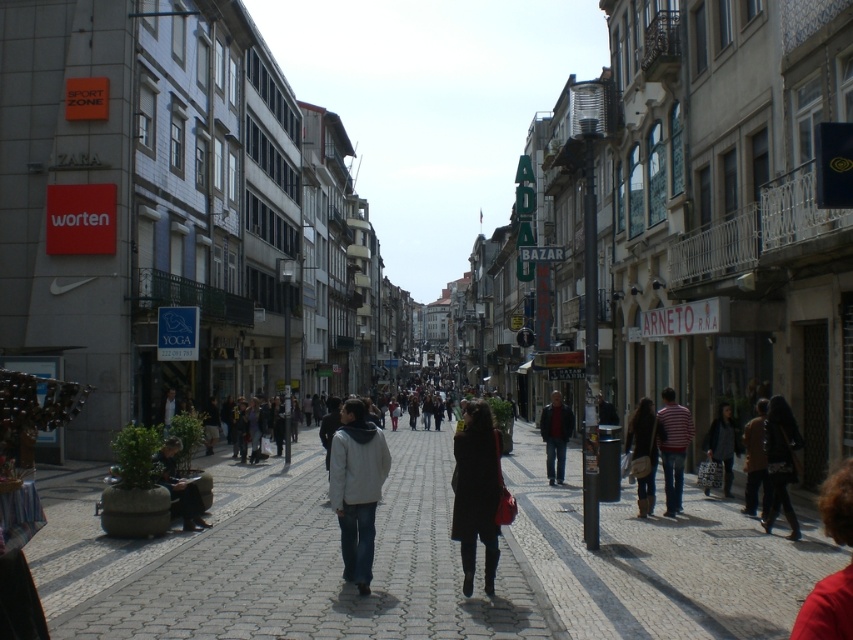
Based on the photo, you are a fashion designer observing the street scene and notice two items of clothing. The brown leather boots at lower right and the dark brown leather jacket at center. Which item is shorter in height?

The brown leather boots at lower right has a lesser height compared to the dark brown leather jacket at center, so the brown leather boots at lower right is shorter in height.

You are standing on the cobblestone street in the European city scene. There are two points marked in the image. The first point is at coordinates point (73, 625) and the second point is at point (782, 474). Which of these two points is closer to you?

Point (73, 625) is closer to the viewer than point (782, 474).

You are a customer in the European city street scene. You see a black matte coat at center. Where exactly is the black matte coat located in relation to the Zara store and the Worten electronics shop?

The black matte coat at center is positioned at coordinates point (476, 492), which places it centrally between the Zara store and the Worten electronics shop on the left side of the street.